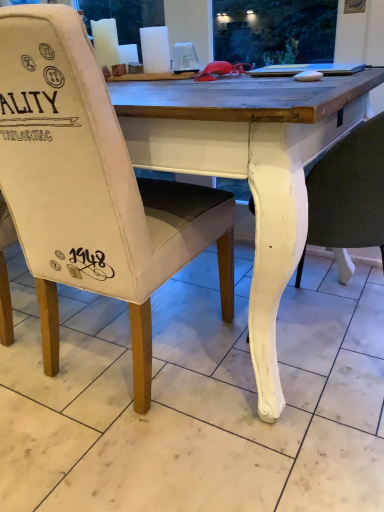
Question: Considering the relative positions of white marble tile at lower center and white painted wood chair at lower right, placed as the second chair when sorted from left to right, in the image provided, is white marble tile at lower center to the left of white painted wood chair at lower right, placed as the second chair when sorted from left to right, from the viewer's perspective?

Choices:
 (A) no
 (B) yes

Answer: (B)

Question: Can you confirm if white marble tile at lower center is positioned to the right of white painted wood chair at lower right, placed as the second chair when sorted from left to right?

Choices:
 (A) no
 (B) yes

Answer: (A)

Question: From the image's perspective, is white marble tile at lower center on top of white painted wood chair at lower right, which appears as the first chair when viewed from the right?

Choices:
 (A) yes
 (B) no

Answer: (B)

Question: Is white marble tile at lower center facing towards white painted wood chair at lower right, which appears as the first chair when viewed from the right?

Choices:
 (A) yes
 (B) no

Answer: (B)

Question: Considering the relative sizes of white marble tile at lower center and white painted wood chair at lower right, placed as the second chair when sorted from left to right, in the image provided, is white marble tile at lower center bigger than white painted wood chair at lower right, placed as the second chair when sorted from left to right,?

Choices:
 (A) no
 (B) yes

Answer: (A)

Question: Does white marble tile at lower center have a lesser width compared to white painted wood chair at lower right, placed as the second chair when sorted from left to right?

Choices:
 (A) yes
 (B) no

Answer: (B)

Question: Can you confirm if canvas chair at center, placed as the second chair when sorted from right to left, is positioned to the left of white marble tile at lower center?

Choices:
 (A) yes
 (B) no

Answer: (A)

Question: Is canvas chair at center, acting as the first chair starting from the left, bigger than white marble tile at lower center?

Choices:
 (A) yes
 (B) no

Answer: (A)

Question: Does canvas chair at center, placed as the second chair when sorted from right to left, lie behind white marble tile at lower center?

Choices:
 (A) yes
 (B) no

Answer: (A)

Question: Is canvas chair at center, acting as the first chair starting from the left, outside of white marble tile at lower center?

Choices:
 (A) no
 (B) yes

Answer: (B)

Question: From the image's perspective, is canvas chair at center, acting as the first chair starting from the left, below white marble tile at lower center?

Choices:
 (A) no
 (B) yes

Answer: (A)

Question: Are canvas chair at center, placed as the second chair when sorted from right to left, and white marble tile at lower center located far from each other?

Choices:
 (A) yes
 (B) no

Answer: (B)

Question: Is white painted wood chair at lower right, which appears as the first chair when viewed from the right, placed right next to canvas chair at center, acting as the first chair starting from the left?

Choices:
 (A) yes
 (B) no

Answer: (B)